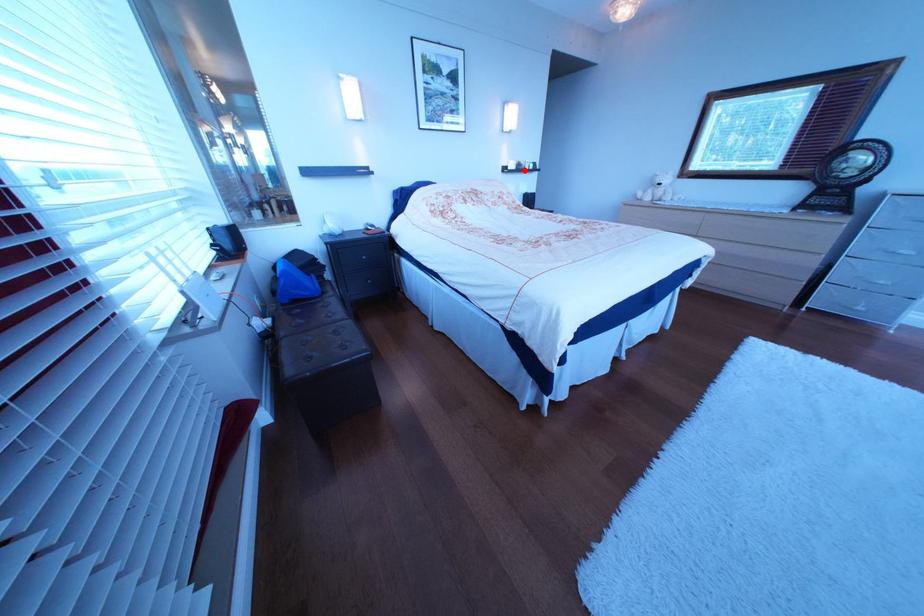
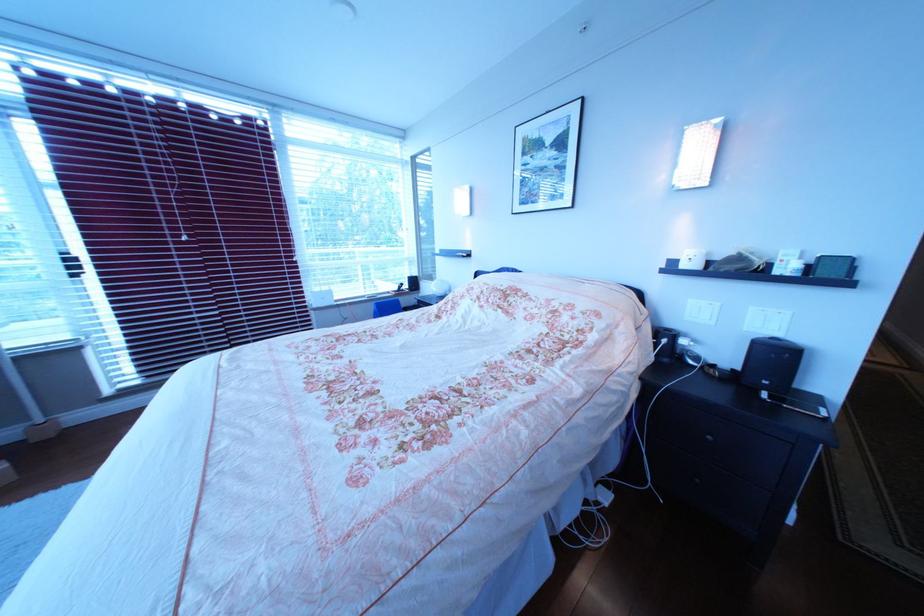
Question: I am providing you with two images of the same scene from different viewpoints. In image1, a red point is highlighted. Considering the same 3D point in image2, which of the following is correct?

Choices:
 (A) It is closer
 (B) It is farther

Answer: (B)